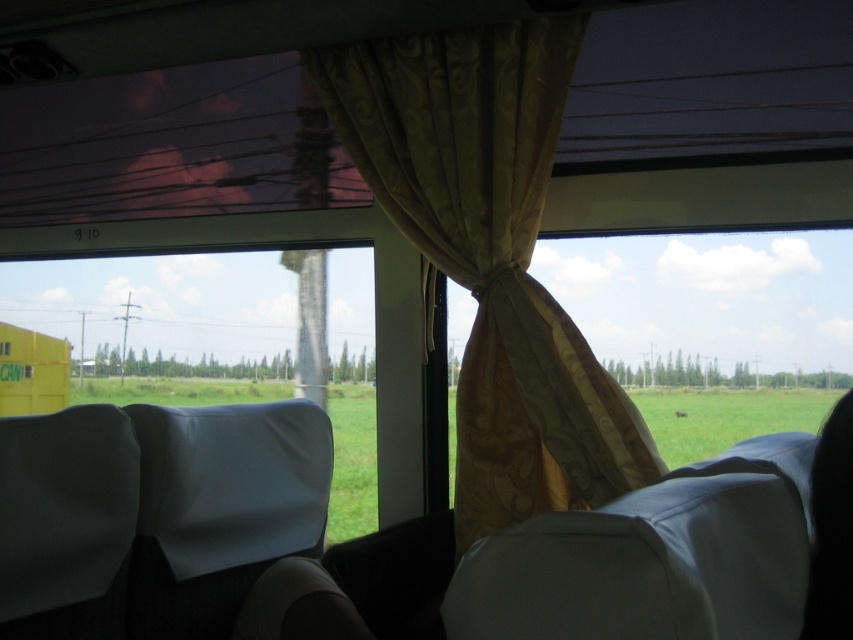
You are a bus passenger trying to decide where to sit. You want to choose a seat that allows you to see the view outside the window best. Given that the green matte window at center and the white fabric chair at center are both in the same row, which object should you sit closer to?

The green matte window at center has a larger width than the white fabric chair at center, so sitting closer to the green matte window at center would provide a better view of the outside scenery.

You are a passenger sitting in the bus and want to look outside through the green matte window at center. Based on the scene description, where exactly is the green matte window positioned in the bus? Please provide its coordinates as mentioned in the Objects Description.

The green matte window at center is located at point coordinates of (216, 342).

Consider the image. You are a passenger sitting in the white fabric chair at center of the bus. You want to see the view outside the window but the gold silk curtain at center is blocking your view. Can you see the window by moving your head upwards?

The gold silk curtain at center has a greater height compared to the white fabric chair at center, so moving your head upwards might allow you to see above the curtain and view the window outside.